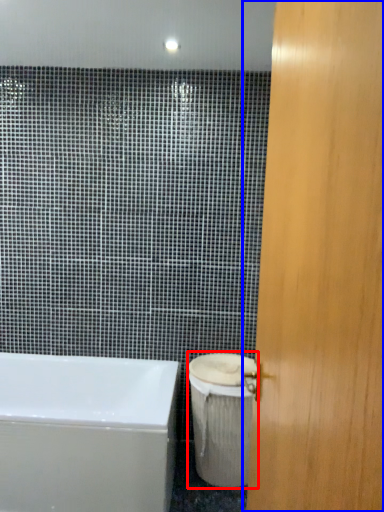
Question: Which object appears farthest to the camera in this image, toilet bowl (highlighted by a red box) or door (highlighted by a blue box)?

Choices:
 (A) toilet bowl
 (B) door

Answer: (A)